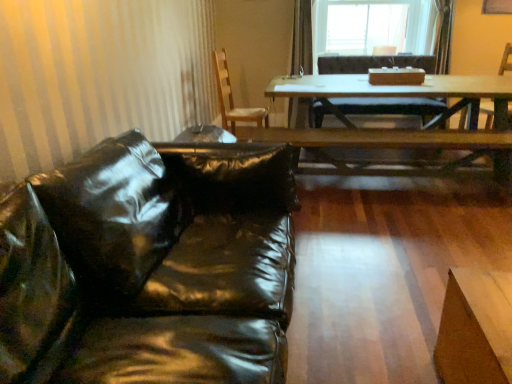
Question: Is wooden chair at center, acting as the 2th chair starting from the right, to the left or to the right of glossy black leather couch at left in the image?

Choices:
 (A) right
 (B) left

Answer: (A)

Question: Would you say wooden chair at center, which is counted as the first chair, starting from the left, is inside or outside glossy black leather couch at left?

Choices:
 (A) inside
 (B) outside

Answer: (B)

Question: Estimate the real-world distances between objects in this image. Which object is closer to the transparent plastic window screen at upper center?

Choices:
 (A) wooden table at center
 (B) wooden armchair at right
 (C) glossy black leather couch at left
 (D) wooden chair at center, which is counted as the first chair, starting from the left
 (E) brown leather chair at upper right, which ranks as the 1th chair in right-to-left order

Answer: (A)

Question: Which object is the closest to the wooden armchair at right?

Choices:
 (A) brown leather chair at upper right, which ranks as the 1th chair in right-to-left order
 (B) transparent plastic window screen at upper center
 (C) glossy black leather couch at left
 (D) wooden table at center
 (E) wooden chair at center, which is counted as the first chair, starting from the left

Answer: (A)